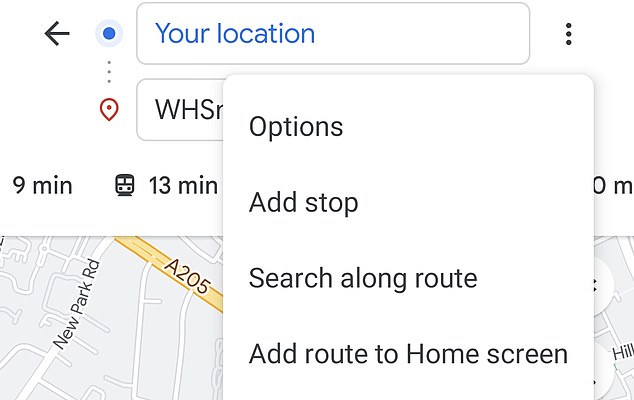
Locate an element on the screen. map is located at coordinates (122, 333), (619, 325).